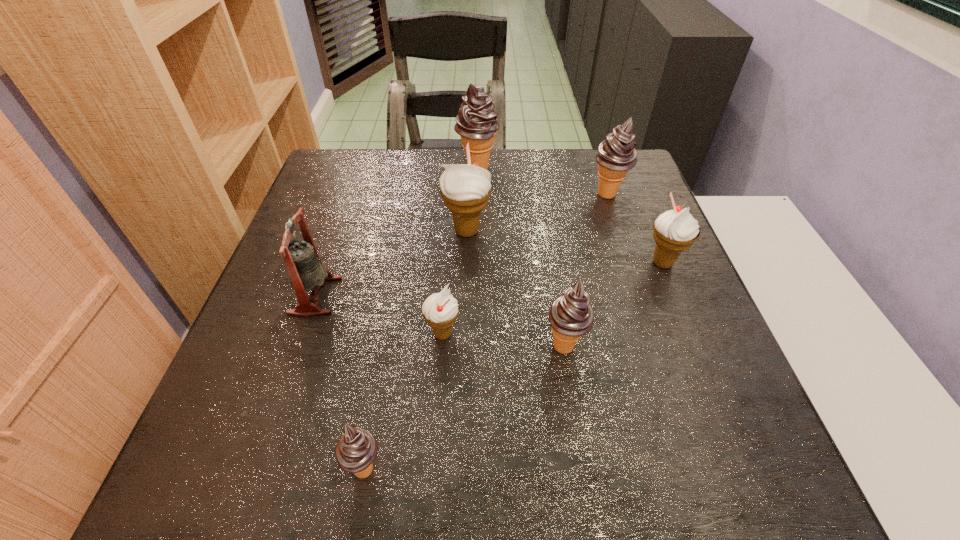
The image size is (960, 540). Find the location of `the third chocolate icecream from right to left`. the third chocolate icecream from right to left is located at coordinates (476, 122).

Identify the location of the farthest icecream. click(476, 122).

The width and height of the screenshot is (960, 540). Find the location of `the second biggest chocolate icecream`. the second biggest chocolate icecream is located at coordinates 617,154.

Where is `the second farthest chocolate icecream`? Image resolution: width=960 pixels, height=540 pixels. the second farthest chocolate icecream is located at coordinates (617, 154).

I want to click on the fifth nearest icecream, so click(465, 188).

Image resolution: width=960 pixels, height=540 pixels. What are the coordinates of `the biggest white icecream` in the screenshot? It's located at (465, 188).

At what (x,y) coordinates should I click in order to perform the action: click on the leftmost object. Please return your answer as a coordinate pair (x, y). This screenshot has height=540, width=960. Looking at the image, I should click on (301, 258).

Where is `the second smallest chocolate icecream`? the second smallest chocolate icecream is located at coordinates (571, 316).

The height and width of the screenshot is (540, 960). Find the location of `the third object from right to left`. the third object from right to left is located at coordinates (571, 316).

The height and width of the screenshot is (540, 960). Identify the location of the second farthest white icecream. (676, 230).